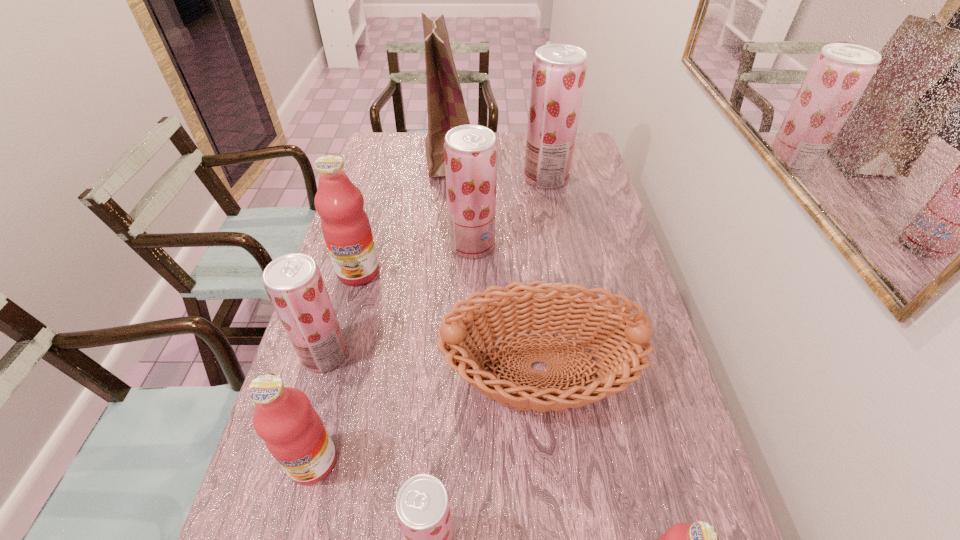
You are a GUI agent. You are given a task and a screenshot of the screen. Output one action in this format:
    pyautogui.click(x=<x>, y=<y>)
    Task: Click on the grocery bag
    The image size is (960, 540).
    Given the screenshot: What is the action you would take?
    pyautogui.click(x=446, y=109)

Image resolution: width=960 pixels, height=540 pixels. In order to click on the biggest strawberry fruit juice in this screenshot , I will do `click(559, 70)`.

Where is `the farthest strawberry fruit juice`? This screenshot has height=540, width=960. the farthest strawberry fruit juice is located at coordinates (559, 70).

Where is `the third nearest strawberry fruit juice`? The image size is (960, 540). the third nearest strawberry fruit juice is located at coordinates (470, 151).

You are a GUI agent. You are given a task and a screenshot of the screen. Output one action in this format:
    pyautogui.click(x=<x>, y=<y>)
    Task: Click on the farthest pink fruit juice
    The image size is (960, 540).
    Given the screenshot: What is the action you would take?
    pyautogui.click(x=345, y=225)

Locate an element on the screen. The image size is (960, 540). brown basket is located at coordinates (541, 306).

Image resolution: width=960 pixels, height=540 pixels. What are the coordinates of `the leftmost strawberry fruit juice` in the screenshot? It's located at (293, 282).

I want to click on the second smallest strawberry fruit juice, so click(x=293, y=282).

Find the location of a particular element. This screenshot has width=960, height=540. the fifth farthest fruit juice is located at coordinates (293, 432).

Image resolution: width=960 pixels, height=540 pixels. Find the location of `the second smallest pink fruit juice`. the second smallest pink fruit juice is located at coordinates (293, 432).